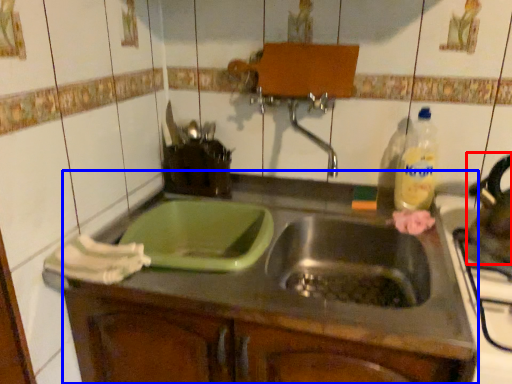
Question: Among these objects, which one is farthest to the camera, tea pot (highlighted by a red box) or countertop (highlighted by a blue box)?

Choices:
 (A) tea pot
 (B) countertop

Answer: (A)